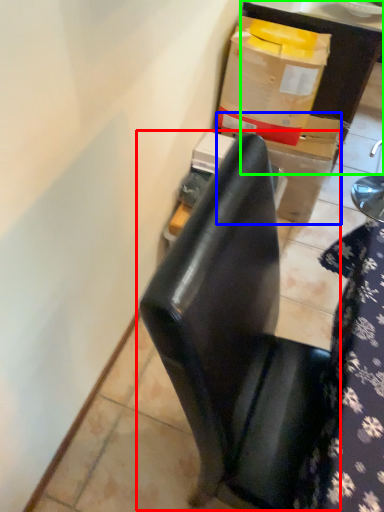
Question: Which object is positioned farthest from chair (highlighted by a red box)? Select from cardboard box (highlighted by a blue box) and furniture (highlighted by a green box).

Choices:
 (A) cardboard box
 (B) furniture

Answer: (B)